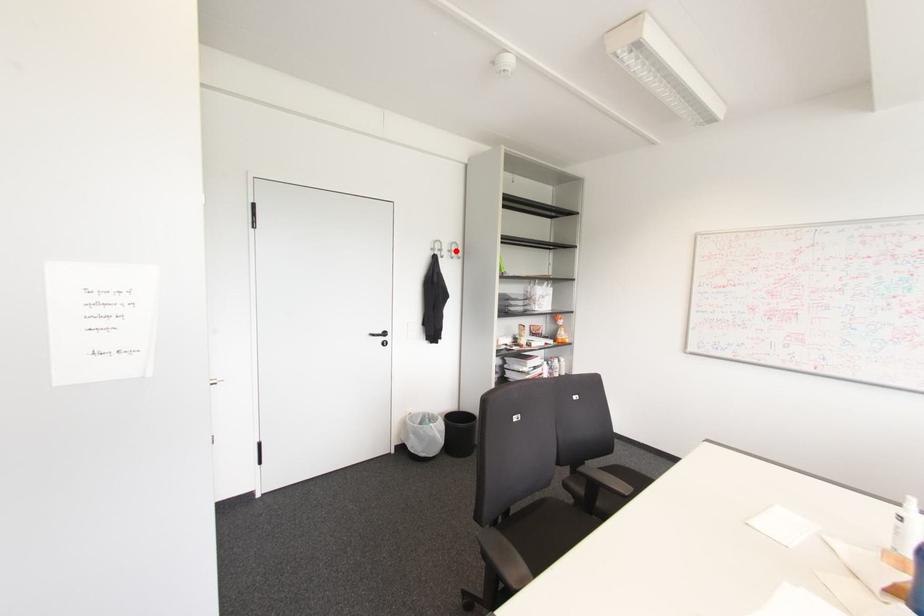
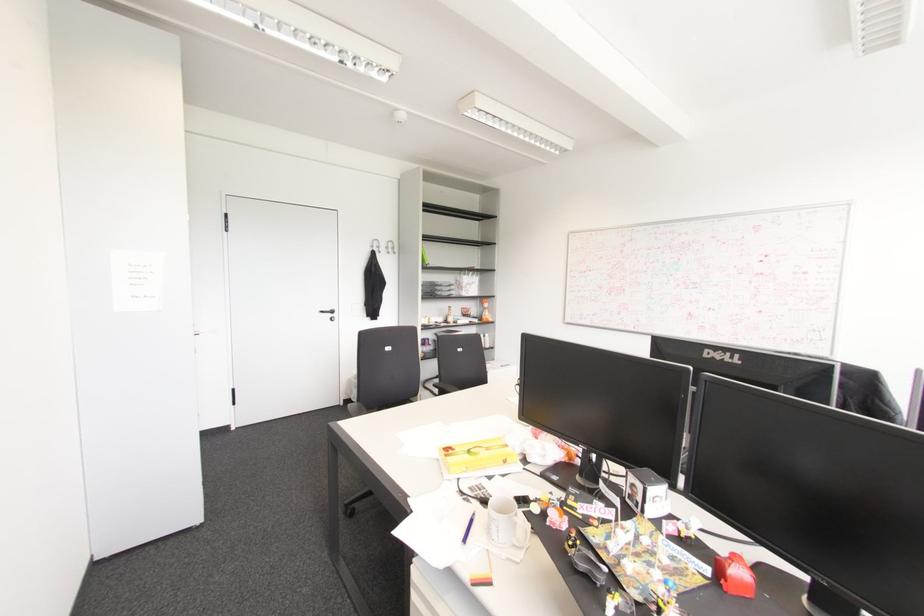
Locate, in the second image, the point that corresponds to the highlighted location in the first image.

(392, 248)